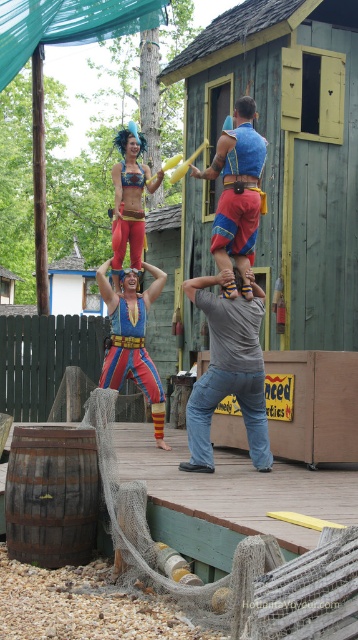
Is point (249, 259) positioned before point (118, 192)?

Yes, it is.

Describe the element at coordinates (238, 193) in the screenshot. I see `blue fabric at center` at that location.

Identify the location of blue fabric at center. The width and height of the screenshot is (358, 640). (238, 193).

From the picture: Can you confirm if gray cotton shirt at center is wider than blue fabric at center?

Indeed, gray cotton shirt at center has a greater width compared to blue fabric at center.

Is gray cotton shirt at center above blue fabric at center?

Actually, gray cotton shirt at center is below blue fabric at center.

Is point (248, 300) in front of point (239, 170)?

Yes, point (248, 300) is closer to viewer.

The image size is (358, 640). What are the coordinates of `gray cotton shirt at center` in the screenshot? It's located at (228, 371).

Is blue fabric at center below shiny metallic bikini top at upper center?

Yes.

Is blue fabric at center thinner than shiny metallic bikini top at upper center?

No.

Is point (226, 298) behind point (131, 184)?

No.

Identify the location of blue fabric at center. This screenshot has width=358, height=640. (238, 193).